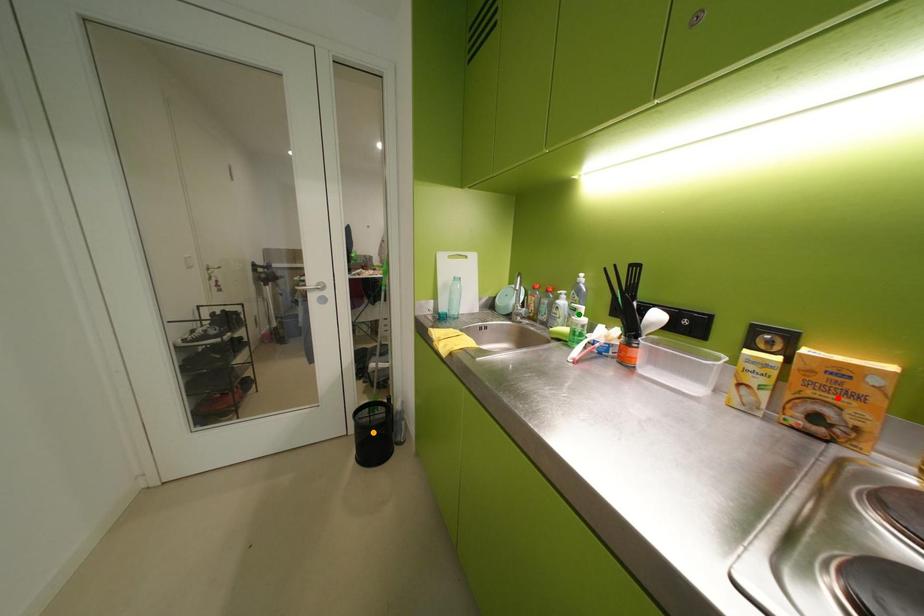
Order these from farthest to nearest:
- green point
- orange point
- red point

orange point
green point
red point